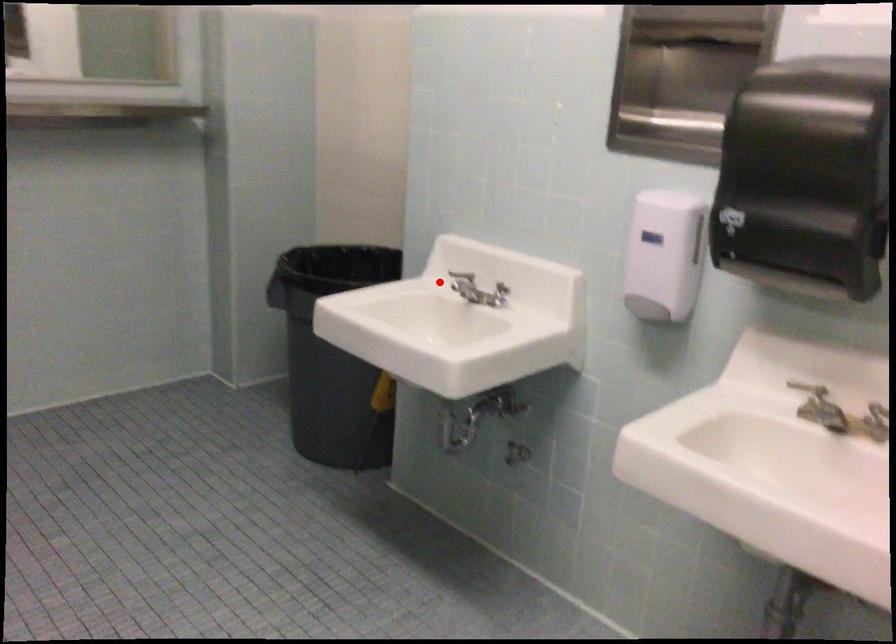
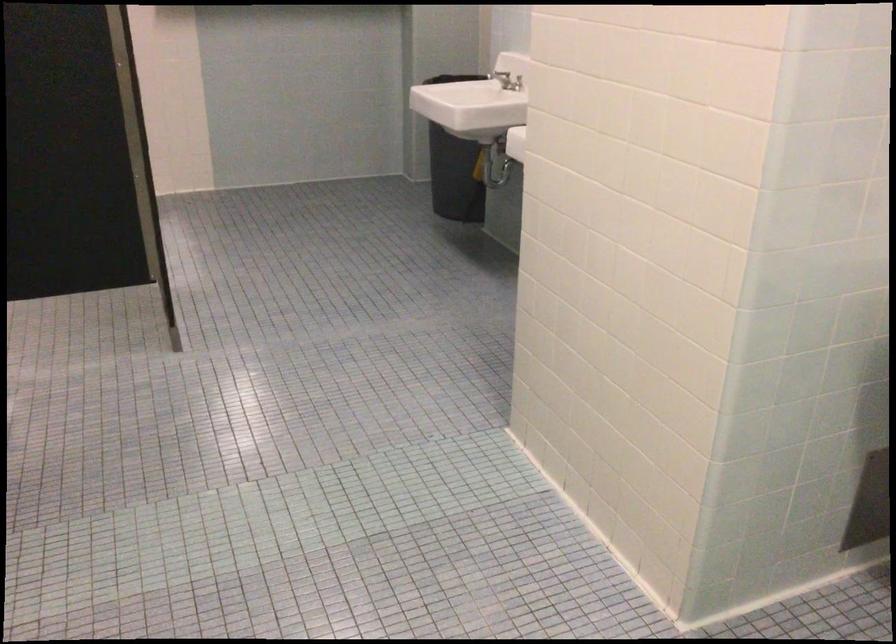
The point at the highlighted location is marked in the first image. Where is the corresponding point in the second image?

(500, 75)